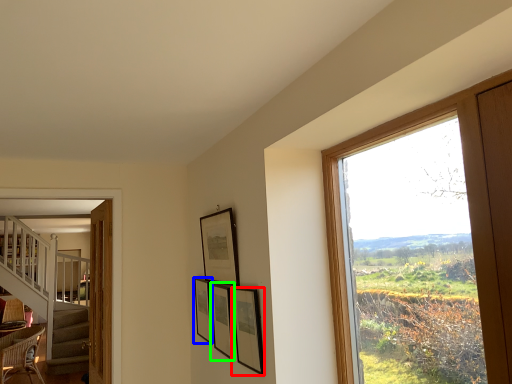
Question: Based on their relative distances, which object is nearer to picture frame (highlighted by a red box)? Choose from picture frame (highlighted by a blue box) and picture frame (highlighted by a green box).

Choices:
 (A) picture frame
 (B) picture frame

Answer: (B)